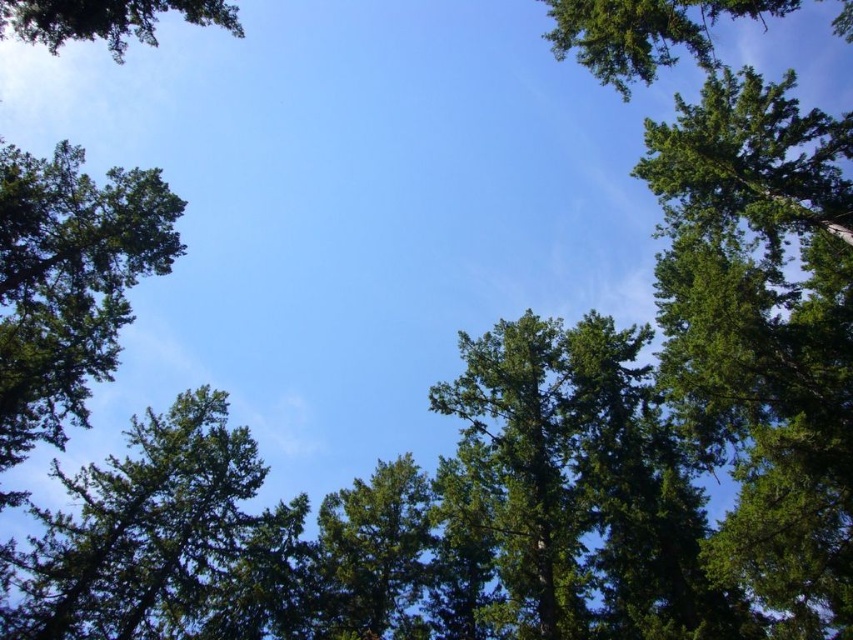
You are standing under a group of tall trees and looking up at the sky. You notice two trees in your view, the green leafy tree at left and the green leafy tree at upper right. Which tree is positioned more to the left side of your view?

The green leafy tree at left is positioned more to the left side of your view than the green leafy tree at upper right.

You are a bird flying above the trees and want to land on a branch. Which tree, the green textured tree at lower left or the green leafy tree at center, is closer to you from your current position?

The green textured tree at lower left is positioned over the green leafy tree at center, so the green textured tree at lower left is closer to you.